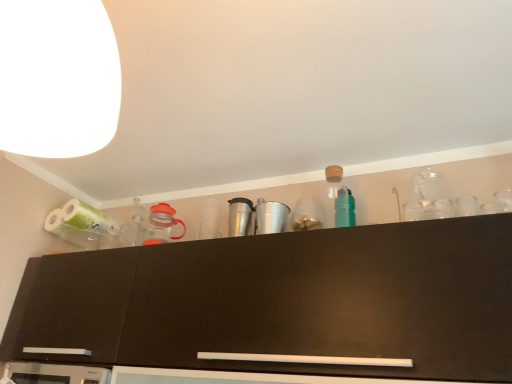
Question: Is white matte lampshade at upper left situated inside matte black cabinet at upper center or outside?

Choices:
 (A) inside
 (B) outside

Answer: (B)

Question: In terms of width, does white matte lampshade at upper left look wider or thinner when compared to matte black cabinet at upper center?

Choices:
 (A) wide
 (B) thin

Answer: (B)

Question: Considering the positions of point (49, 46) and point (214, 292), is point (49, 46) closer or farther from the camera than point (214, 292)?

Choices:
 (A) closer
 (B) farther

Answer: (A)

Question: Is point (489, 354) closer or farther from the camera than point (60, 81)?

Choices:
 (A) farther
 (B) closer

Answer: (A)

Question: From a real-world perspective, relative to white matte lampshade at upper left, is matte black cabinet at upper center vertically above or below?

Choices:
 (A) below
 (B) above

Answer: (A)

Question: Is matte black cabinet at upper center inside the boundaries of white matte lampshade at upper left, or outside?

Choices:
 (A) inside
 (B) outside

Answer: (B)

Question: Looking at their shapes, would you say matte black cabinet at upper center is wider or thinner than white matte lampshade at upper left?

Choices:
 (A) thin
 (B) wide

Answer: (B)